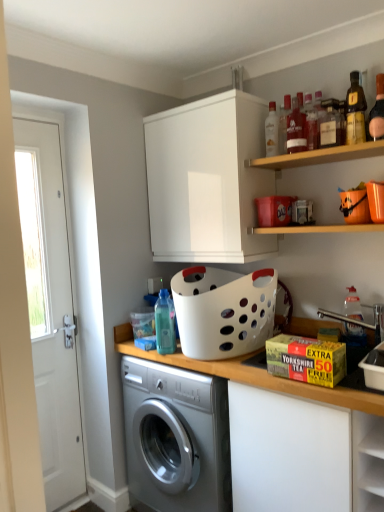
Question: From the image's perspective, does white glossy door at left appear lower than wooden shelf at upper right, which ranks as the first shelf in bottom-to-top order?

Choices:
 (A) yes
 (B) no

Answer: (A)

Question: Are white glossy door at left and wooden shelf at upper right, which is the second shelf from top to bottom, making contact?

Choices:
 (A) no
 (B) yes

Answer: (A)

Question: From the image's perspective, is white glossy door at left located above wooden shelf at upper right, which ranks as the first shelf in bottom-to-top order?

Choices:
 (A) no
 (B) yes

Answer: (A)

Question: Is white glossy door at left positioned with its back to wooden shelf at upper right, which is the second shelf from top to bottom?

Choices:
 (A) yes
 (B) no

Answer: (B)

Question: Can you confirm if white glossy door at left is shorter than wooden shelf at upper right, which is the second shelf from top to bottom?

Choices:
 (A) yes
 (B) no

Answer: (B)

Question: From their relative heights in the image, would you say translucent glass bottle at upper right, the 6th bottle when ordered from left to right, is taller or shorter than translucent plastic bottle at right, which is the second bottle from right to left?

Choices:
 (A) short
 (B) tall

Answer: (A)

Question: Based on their sizes in the image, would you say translucent glass bottle at upper right, the 6th bottle when ordered from left to right, is bigger or smaller than translucent plastic bottle at right, the eighth bottle viewed from the left?

Choices:
 (A) big
 (B) small

Answer: (B)

Question: Is point (327, 131) closer or farther from the camera than point (347, 307)?

Choices:
 (A) farther
 (B) closer

Answer: (B)

Question: Considering the positions of translucent glass bottle at upper right, placed as the fourth bottle when sorted from right to left, and translucent plastic bottle at right, which is the second bottle from right to left, in the image, is translucent glass bottle at upper right, placed as the fourth bottle when sorted from right to left, wider or thinner than translucent plastic bottle at right, which is the second bottle from right to left,?

Choices:
 (A) wide
 (B) thin

Answer: (A)

Question: Considering the positions of matte glass bottle at upper center, which is counted as the 6th bottle, starting from the right, and translucent glass bottle at upper right, the 6th bottle when ordered from left to right, in the image, is matte glass bottle at upper center, which is counted as the 6th bottle, starting from the right, wider or thinner than translucent glass bottle at upper right, the 6th bottle when ordered from left to right,?

Choices:
 (A) wide
 (B) thin

Answer: (B)

Question: Is matte glass bottle at upper center, which is counted as the 6th bottle, starting from the right, situated inside translucent glass bottle at upper right, placed as the fourth bottle when sorted from right to left, or outside?

Choices:
 (A) outside
 (B) inside

Answer: (A)

Question: Relative to translucent glass bottle at upper right, the 6th bottle when ordered from left to right, is matte glass bottle at upper center, which is counted as the 6th bottle, starting from the right, in front or behind?

Choices:
 (A) behind
 (B) front

Answer: (A)

Question: Is point (301, 117) closer or farther from the camera than point (324, 100)?

Choices:
 (A) farther
 (B) closer

Answer: (B)

Question: In terms of height, does clear glass bottle at upper center, which is counted as the second bottle, starting from the left, look taller or shorter compared to translucent glass bottle at upper right, which is the first bottle from right to left?

Choices:
 (A) tall
 (B) short

Answer: (B)

Question: Does point (266, 124) appear closer or farther from the camera than point (380, 134)?

Choices:
 (A) farther
 (B) closer

Answer: (A)